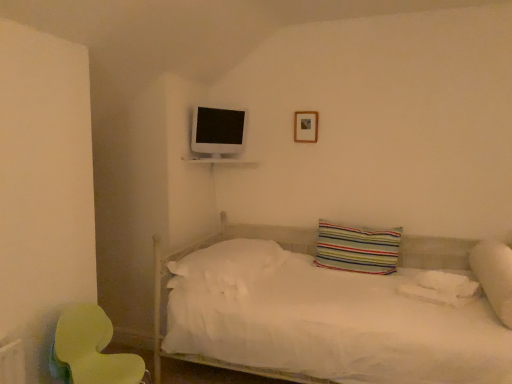
Question: Is white soft pillow at right, which is the third pillow from left to right, taller or shorter than white soft pillow at center, which is counted as the first pillow, starting from the left?

Choices:
 (A) short
 (B) tall

Answer: (B)

Question: Is white soft pillow at right, which is the third pillow from left to right, inside or outside of white soft pillow at center, which is counted as the first pillow, starting from the left?

Choices:
 (A) inside
 (B) outside

Answer: (B)

Question: Considering the real-world distances, which object is closest to the white soft pillow at right, which is the third pillow from left to right?

Choices:
 (A) green plastic swivel chair at lower left
 (B) white soft pillow at center, acting as the 3th pillow starting from the right
 (C) striped fabric pillow at center, positioned as the 2th pillow in left-to-right order
 (D) white glossy shelf at upper center
 (E) wooden picture frame at upper center

Answer: (C)

Question: Which is farther from the wooden picture frame at upper center?

Choices:
 (A) white soft pillow at center, which is counted as the first pillow, starting from the left
 (B) white glossy shelf at upper center
 (C) striped fabric pillow at center, positioned as the 2th pillow in left-to-right order
 (D) white soft pillow at right, which is the third pillow from left to right
 (E) green plastic swivel chair at lower left

Answer: (E)